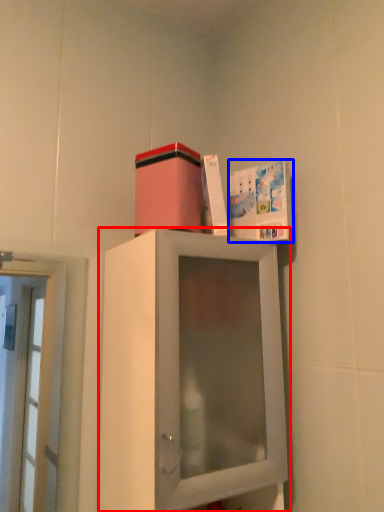
Question: Which object appears closest to the camera in this image, cabinetry (highlighted by a red box) or book cover (highlighted by a blue box)?

Choices:
 (A) cabinetry
 (B) book cover

Answer: (A)